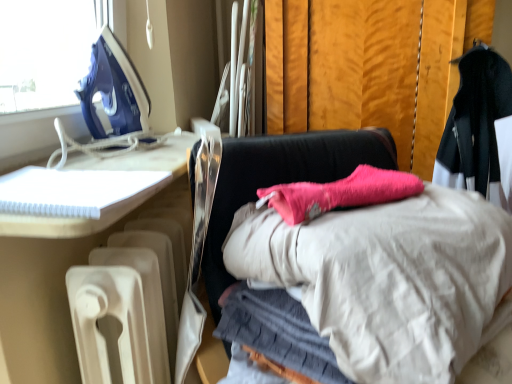
Identify the location of vacant area that is in front of blue plastic iron at upper left. (116, 159).